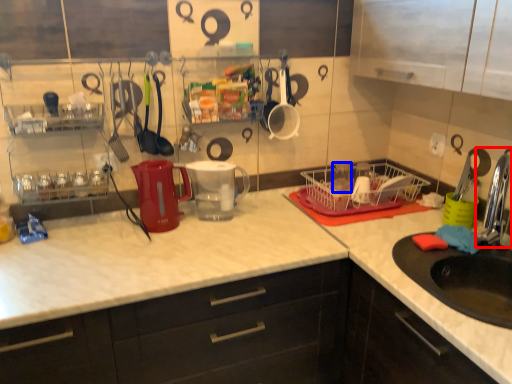
Question: Which point is further to the camera, faucet (highlighted by a red box) or tableware (highlighted by a blue box)?

Choices:
 (A) faucet
 (B) tableware

Answer: (B)